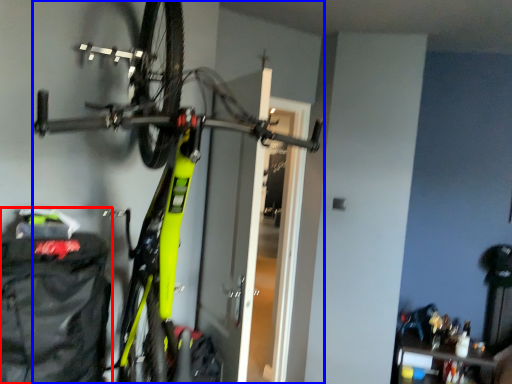
Question: Which point is further to the camera, backpack (highlighted by a red box) or bicycle (highlighted by a blue box)?

Choices:
 (A) backpack
 (B) bicycle

Answer: (A)